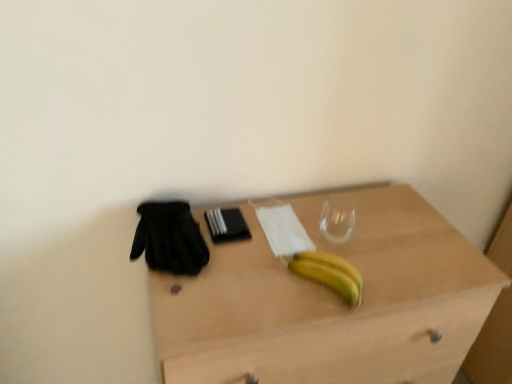
Identify the location of vacant region in front of yellow matte banana at center. Image resolution: width=512 pixels, height=384 pixels. (308, 307).